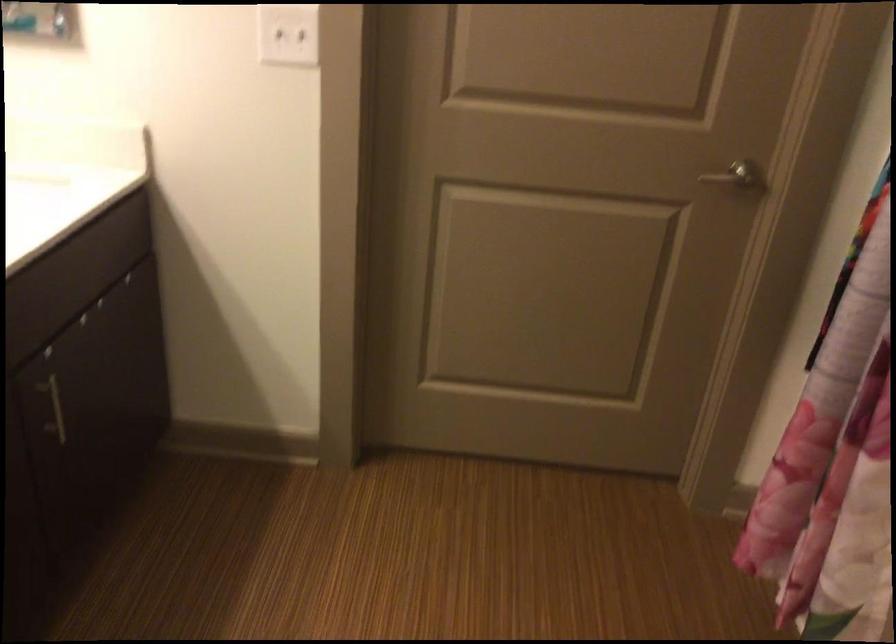
Where would you pull the silver cabinet handle? Please return your answer as a coordinate pair (x, y).

(54, 409)